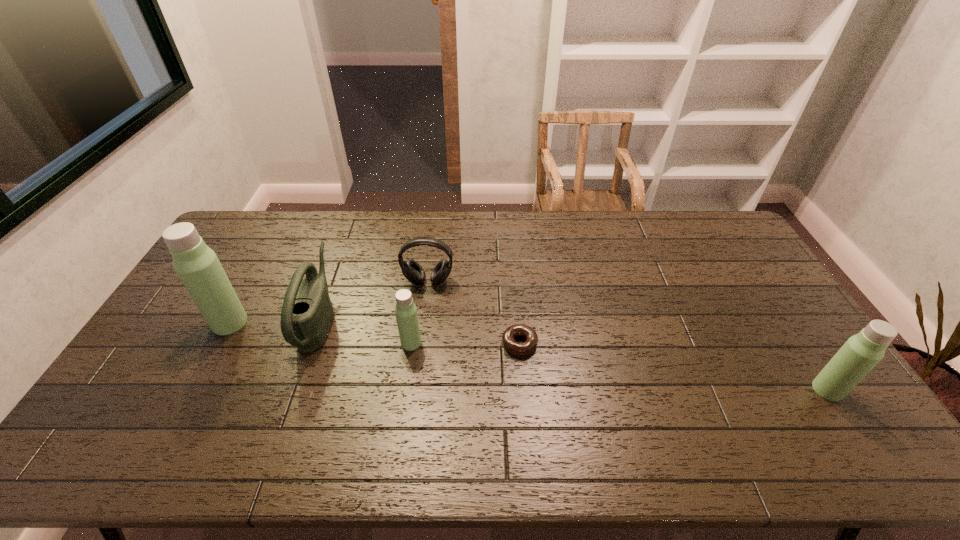
The image size is (960, 540). Find the location of `vacant space at the near edge`. vacant space at the near edge is located at coordinates (621, 397).

The height and width of the screenshot is (540, 960). Find the location of `free region at the left edge of the desktop`. free region at the left edge of the desktop is located at coordinates (228, 252).

Find the location of `free space at the right edge of the desktop`. free space at the right edge of the desktop is located at coordinates (715, 277).

Where is `free space that is in between the second thermos bottle from right to left and the watering can`? The height and width of the screenshot is (540, 960). free space that is in between the second thermos bottle from right to left and the watering can is located at coordinates (366, 331).

At what (x,y) coordinates should I click in order to perform the action: click on free space between the second shortest thermos bottle and the shortest thermos bottle. Please return your answer as a coordinate pair (x, y). This screenshot has height=540, width=960. Looking at the image, I should click on (619, 366).

Image resolution: width=960 pixels, height=540 pixels. I want to click on vacant area that lies between the fifth object from left to right and the leftmost thermos bottle, so click(374, 333).

The height and width of the screenshot is (540, 960). Identify the location of unoccupied position between the shortest object and the second tallest thermos bottle. (674, 367).

Locate an element on the screen. Image resolution: width=960 pixels, height=540 pixels. vacant space in between the nearest object and the fifth object from right to left is located at coordinates (573, 355).

Locate an element on the screen. vacant region between the shortest object and the leftmost thermos bottle is located at coordinates (374, 333).

Image resolution: width=960 pixels, height=540 pixels. In order to click on blank region between the rightmost thermos bottle and the watering can in this screenshot , I will do `click(573, 355)`.